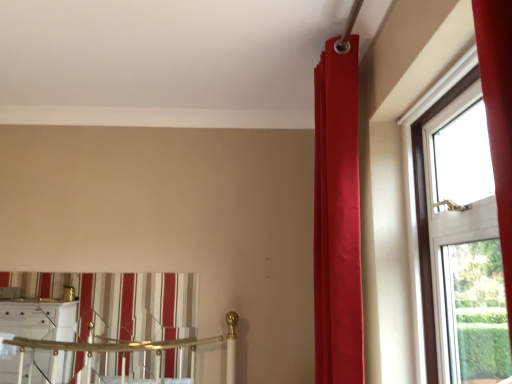
Describe the element at coordinates (426, 204) in the screenshot. I see `transparent glass window at right` at that location.

The width and height of the screenshot is (512, 384). Identify the location of satin red curtain at upper right, the first curtain from the front. (337, 219).

You are a GUI agent. You are given a task and a screenshot of the screen. Output one action in this format:
    pyautogui.click(x=<x>, y=<y>)
    Task: Click on the transparent glass window at right
    
    Given the screenshot: What is the action you would take?
    pyautogui.click(x=426, y=204)

From a real-world perspective, relative to satin red curtain at upper right, which ranks as the first curtain in right-to-left order, is striped fabric curtain at lower left, the second curtain viewed from the front, vertically above or below?

In terms of real-world spatial position, striped fabric curtain at lower left, the second curtain viewed from the front, is below satin red curtain at upper right, which ranks as the first curtain in right-to-left order.

Is striped fabric curtain at lower left, which is the 1th curtain from left to right, not near satin red curtain at upper right, which ranks as the first curtain in right-to-left order?

Yes, striped fabric curtain at lower left, which is the 1th curtain from left to right, and satin red curtain at upper right, which ranks as the first curtain in right-to-left order, are quite far apart.

Does point (191, 315) come farther from viewer compared to point (320, 358)?

That is True.

Is striped fabric curtain at lower left, placed as the 2th curtain when sorted from right to left, not inside satin red curtain at upper right, which ranks as the first curtain in right-to-left order?

Yes, striped fabric curtain at lower left, placed as the 2th curtain when sorted from right to left, is not within satin red curtain at upper right, which ranks as the first curtain in right-to-left order.

Is satin red curtain at upper right, marked as the 2th curtain in a left-to-right arrangement, in front of or behind striped fabric curtain at lower left, which is the 1th curtain from left to right, in the image?

Clearly, satin red curtain at upper right, marked as the 2th curtain in a left-to-right arrangement, is in front of striped fabric curtain at lower left, which is the 1th curtain from left to right.

Does point (314, 322) appear closer or farther from the camera than point (160, 285)?

Point (314, 322).

Considering the relative sizes of satin red curtain at upper right, marked as the 2th curtain in a left-to-right arrangement, and striped fabric curtain at lower left, placed as the first curtain when sorted from back to front, in the image provided, is satin red curtain at upper right, marked as the 2th curtain in a left-to-right arrangement, thinner than striped fabric curtain at lower left, placed as the first curtain when sorted from back to front,?

In fact, satin red curtain at upper right, marked as the 2th curtain in a left-to-right arrangement, might be wider than striped fabric curtain at lower left, placed as the first curtain when sorted from back to front.

Can you tell me how much satin red curtain at upper right, marked as the 2th curtain in a left-to-right arrangement, and transparent glass window at right differ in facing direction?

There is a 1.4-degree angle between the facing directions of satin red curtain at upper right, marked as the 2th curtain in a left-to-right arrangement, and transparent glass window at right.

Is satin red curtain at upper right, marked as the 2th curtain in a left-to-right arrangement, at the right side of transparent glass window at right?

Incorrect, satin red curtain at upper right, marked as the 2th curtain in a left-to-right arrangement, is not on the right side of transparent glass window at right.

From the picture: Can we say satin red curtain at upper right, marked as the second curtain in a back-to-front arrangement, lies outside transparent glass window at right?

satin red curtain at upper right, marked as the second curtain in a back-to-front arrangement, lies outside transparent glass window at right's area.

Could you tell me if satin red curtain at upper right, the first curtain from the front, is turned towards transparent glass window at right?

No, satin red curtain at upper right, the first curtain from the front, is not aimed at transparent glass window at right.

From a real-world perspective, which is physically above, transparent glass window at right or satin red curtain at upper right, which ranks as the first curtain in right-to-left order?

From a 3D spatial view, satin red curtain at upper right, which ranks as the first curtain in right-to-left order, is above.

Who is shorter, transparent glass window at right or satin red curtain at upper right, marked as the second curtain in a back-to-front arrangement?

transparent glass window at right is shorter.

In the scene shown: Which object is more forward, transparent glass window at right or satin red curtain at upper right, marked as the 2th curtain in a left-to-right arrangement?

transparent glass window at right.

Locate an element on the screen. This screenshot has width=512, height=384. window below the satin red curtain at upper right, the first curtain from the front (from the image's perspective) is located at coordinates (426, 204).

Are striped fabric curtain at lower left, which is the 1th curtain from left to right, and transparent glass window at right far apart?

Yes, striped fabric curtain at lower left, which is the 1th curtain from left to right, is far from transparent glass window at right.

How many degrees apart are the facing directions of striped fabric curtain at lower left, which is the 1th curtain from left to right, and transparent glass window at right?

91.9 degrees.

How far apart are striped fabric curtain at lower left, which is the 1th curtain from left to right, and transparent glass window at right?

The distance of striped fabric curtain at lower left, which is the 1th curtain from left to right, from transparent glass window at right is 5.51 feet.

Who is taller, striped fabric curtain at lower left, placed as the first curtain when sorted from back to front, or transparent glass window at right?

transparent glass window at right is taller.

Would you say transparent glass window at right is a long distance from striped fabric curtain at lower left, placed as the 2th curtain when sorted from right to left?

Yes, transparent glass window at right and striped fabric curtain at lower left, placed as the 2th curtain when sorted from right to left, are located far from each other.

From the picture: Considering the relative positions of transparent glass window at right and striped fabric curtain at lower left, placed as the first curtain when sorted from back to front, in the image provided, is transparent glass window at right to the right of striped fabric curtain at lower left, placed as the first curtain when sorted from back to front, from the viewer's perspective?

Yes, transparent glass window at right is to the right of striped fabric curtain at lower left, placed as the first curtain when sorted from back to front.

Is transparent glass window at right taller or shorter than striped fabric curtain at lower left, placed as the first curtain when sorted from back to front?

Considering their sizes, transparent glass window at right has more height than striped fabric curtain at lower left, placed as the first curtain when sorted from back to front.

Where is `curtain above the striped fabric curtain at lower left, the second curtain viewed from the front (from the image's perspective)`? The image size is (512, 384). curtain above the striped fabric curtain at lower left, the second curtain viewed from the front (from the image's perspective) is located at coordinates (337, 219).

What are the coordinates of `curtain on the left of satin red curtain at upper right, marked as the 2th curtain in a left-to-right arrangement` in the screenshot? It's located at (119, 303).

Considering their positions, is transparent glass window at right positioned closer to striped fabric curtain at lower left, the second curtain viewed from the front, than satin red curtain at upper right, which ranks as the first curtain in right-to-left order?

Based on the image, satin red curtain at upper right, which ranks as the first curtain in right-to-left order, appears to be nearer to striped fabric curtain at lower left, the second curtain viewed from the front.

Looking at the image, which one is located further to transparent glass window at right, satin red curtain at upper right, marked as the second curtain in a back-to-front arrangement, or striped fabric curtain at lower left, placed as the 2th curtain when sorted from right to left?

striped fabric curtain at lower left, placed as the 2th curtain when sorted from right to left, lies further to transparent glass window at right than the other object.

Estimate the real-world distances between objects in this image. Which object is further from satin red curtain at upper right, marked as the second curtain in a back-to-front arrangement, transparent glass window at right or striped fabric curtain at lower left, the second curtain viewed from the front?

The object further to satin red curtain at upper right, marked as the second curtain in a back-to-front arrangement, is striped fabric curtain at lower left, the second curtain viewed from the front.

When comparing their distances from striped fabric curtain at lower left, which is the 1th curtain from left to right, does satin red curtain at upper right, marked as the 2th curtain in a left-to-right arrangement, or transparent glass window at right seem further?

Based on the image, transparent glass window at right appears to be further to striped fabric curtain at lower left, which is the 1th curtain from left to right.

When comparing their distances from satin red curtain at upper right, the first curtain from the front, does striped fabric curtain at lower left, placed as the first curtain when sorted from back to front, or transparent glass window at right seem further?

The object further to satin red curtain at upper right, the first curtain from the front, is striped fabric curtain at lower left, placed as the first curtain when sorted from back to front.

Considering their positions, is striped fabric curtain at lower left, placed as the 2th curtain when sorted from right to left, positioned further to transparent glass window at right than satin red curtain at upper right, the first curtain from the front?

Based on the image, striped fabric curtain at lower left, placed as the 2th curtain when sorted from right to left, appears to be further to transparent glass window at right.

At what (x,y) coordinates should I click in order to perform the action: click on curtain between striped fabric curtain at lower left, which is the 1th curtain from left to right, and transparent glass window at right from left to right. Please return your answer as a coordinate pair (x, y). The height and width of the screenshot is (384, 512). Looking at the image, I should click on (337, 219).